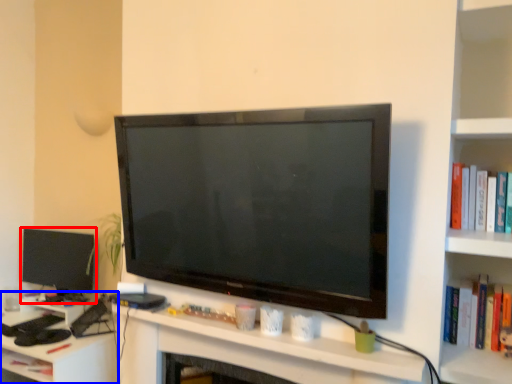
Question: Which object appears farthest to the camera in this image, television (highlighted by a red box) or computer desk (highlighted by a blue box)?

Choices:
 (A) television
 (B) computer desk

Answer: (A)